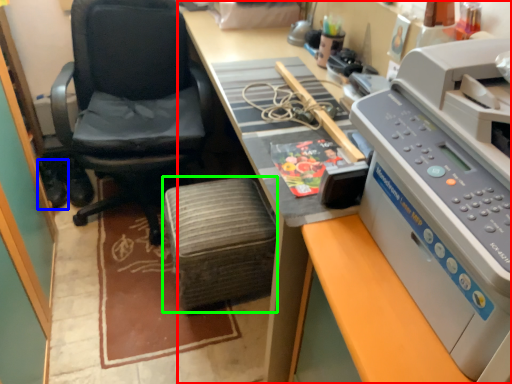
Question: Which object is positioned closest to desk (highlighted by a red box)? Select from footwear (highlighted by a blue box) and stool (highlighted by a green box).

Choices:
 (A) footwear
 (B) stool

Answer: (B)